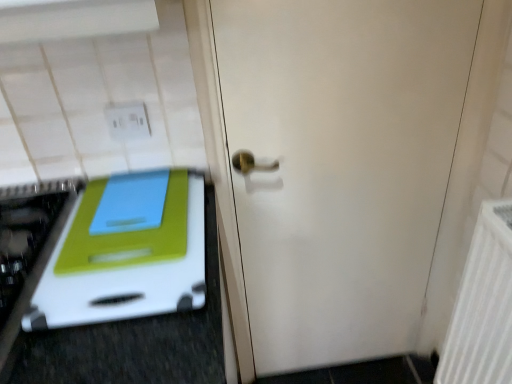
Image resolution: width=512 pixels, height=384 pixels. I want to click on vacant space situated above white plastic cutting board at left (from a real-world perspective), so click(x=125, y=240).